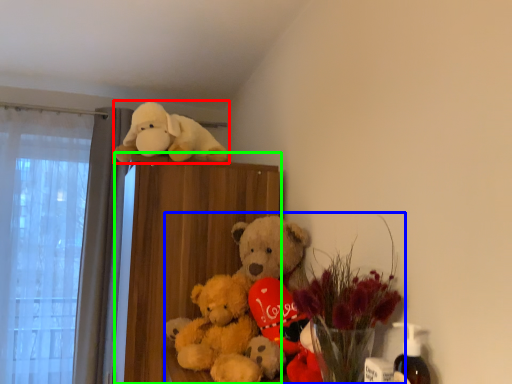
Question: Considering the real-world distances, which object is closest to toy (highlighted by a red box)? floral arrangement (highlighted by a blue box) or bookshelf (highlighted by a green box).

Choices:
 (A) floral arrangement
 (B) bookshelf

Answer: (B)